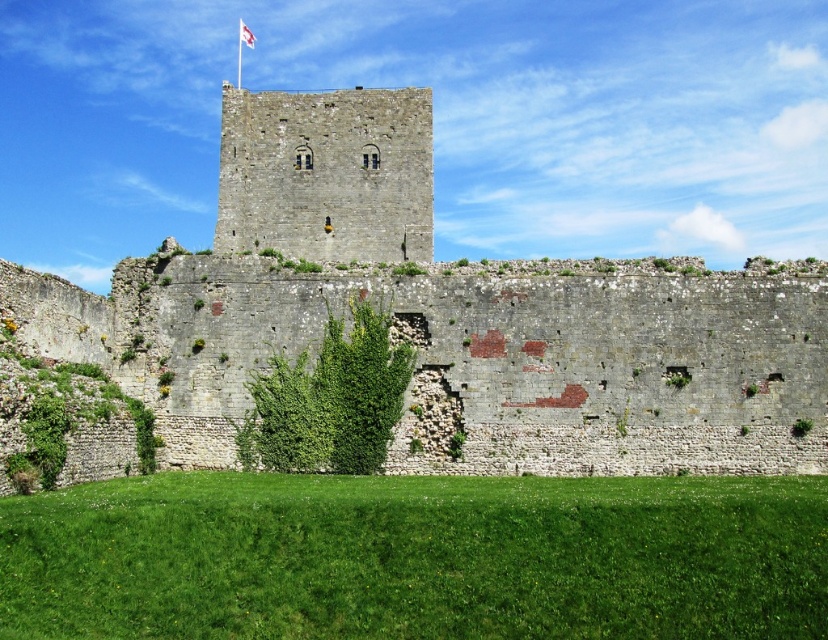
Who is higher up, gray stone tower at center or white fabric flag at upper center?

white fabric flag at upper center is above.

Is point (402, 192) less distant than point (248, 38)?

Yes, point (402, 192) is in front of point (248, 38).

The image size is (828, 640). I want to click on gray stone tower at center, so click(326, 173).

Is gray stone wall at center in front of white fabric flag at upper center?

Yes.

Between gray stone wall at center and white fabric flag at upper center, which one has more height?

gray stone wall at center

Is point (670, 388) farther from viewer compared to point (244, 44)?

No, (670, 388) is closer to viewer.

Locate an element on the screen. gray stone wall at center is located at coordinates (443, 316).

Does gray stone wall at center appear on the right side of gray stone tower at center?

Indeed, gray stone wall at center is positioned on the right side of gray stone tower at center.

Who is more distant from viewer, (415, 124) or (412, 202)?

The point (415, 124) is more distant.

Which is behind, point (807, 292) or point (395, 177)?

The point (395, 177) is behind.

Find the location of a particular element. gray stone wall at center is located at coordinates (443, 316).